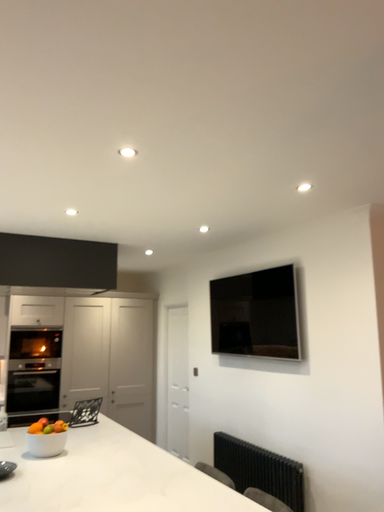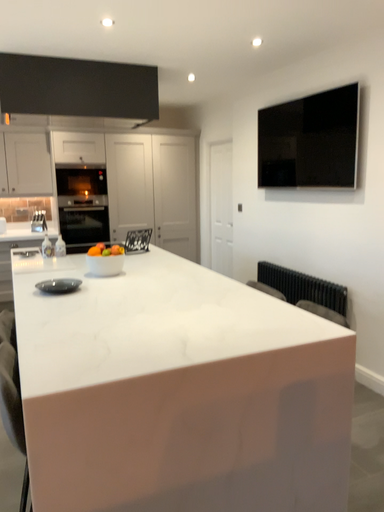
Question: How did the camera likely rotate when shooting the video?

Choices:
 (A) rotated upward
 (B) rotated downward

Answer: (B)